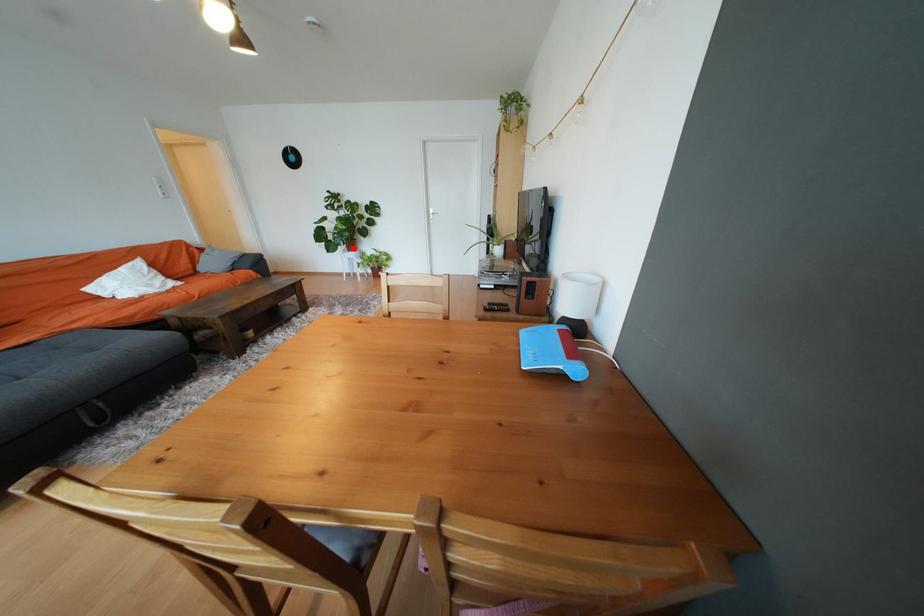
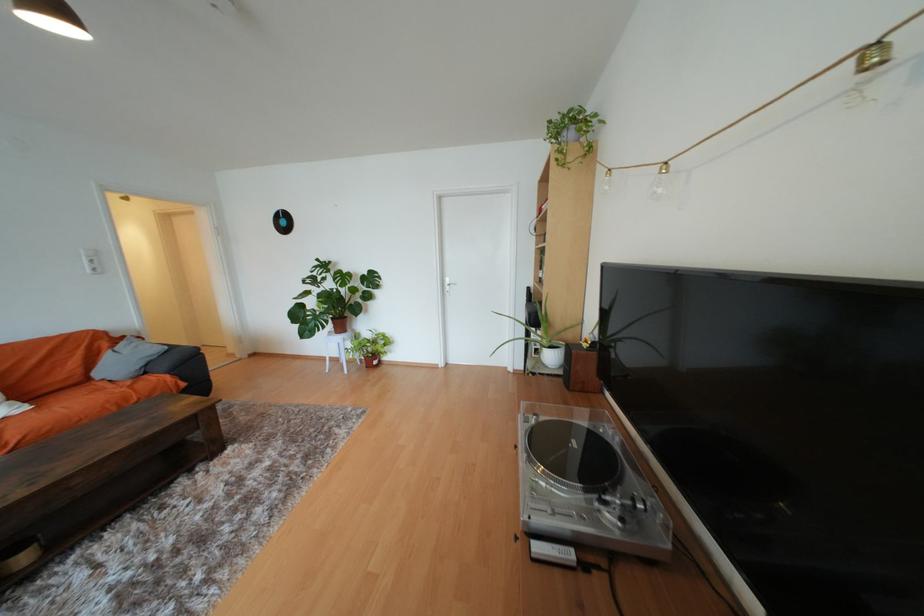
Question: I am providing you with two images of the same scene from different viewpoints. In image1, a red point is highlighted. Considering the same 3D point in image2, which of the following is correct?

Choices:
 (A) It is closer
 (B) It is farther

Answer: (B)